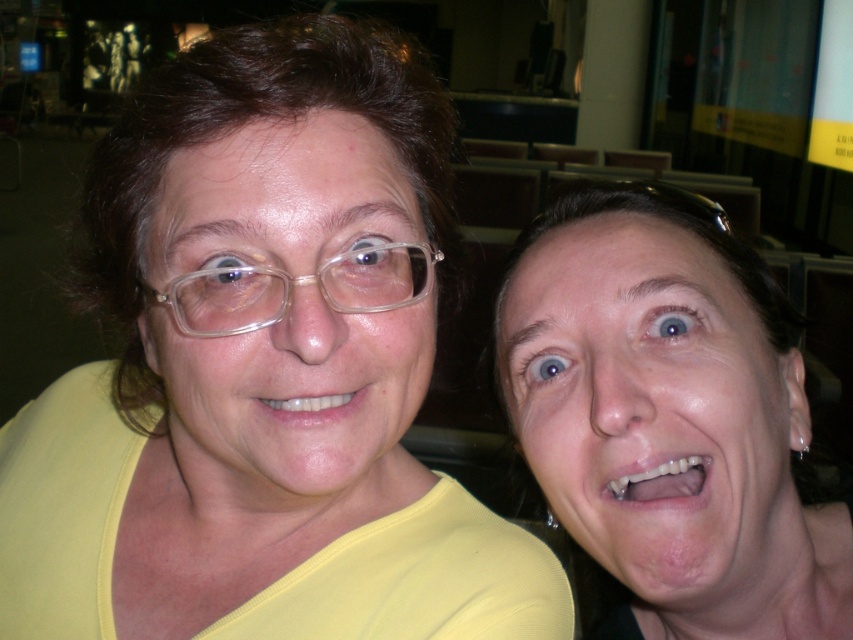
Based on the photo, is transparent plastic glasses at upper left positioned before white glossy teeth at lower center?

Yes, transparent plastic glasses at upper left is closer to the viewer.

Can you confirm if transparent plastic glasses at upper left is positioned to the left of white glossy teeth at lower center?

Correct, you'll find transparent plastic glasses at upper left to the left of white glossy teeth at lower center.

What do you see at coordinates (296, 285) in the screenshot?
I see `transparent plastic glasses at upper left` at bounding box center [296, 285].

In order to click on transparent plastic glasses at upper left in this screenshot , I will do `click(296, 285)`.

Is point (106, 442) closer to viewer compared to point (740, 481)?

No, it is not.

Is yellow matte shirt at upper left to the left of matte yellow shirt at right from the viewer's perspective?

Correct, you'll find yellow matte shirt at upper left to the left of matte yellow shirt at right.

Is point (387, 500) farther from camera compared to point (674, 486)?

Yes, point (387, 500) is farther from viewer.

At what (x,y) coordinates should I click in order to perform the action: click on yellow matte shirt at upper left. Please return your answer as a coordinate pair (x, y). The image size is (853, 640). Looking at the image, I should click on (260, 371).

Does point (170, 308) come farther from viewer compared to point (293, 397)?

Yes, it is behind point (293, 397).

Can you confirm if transparent plastic glasses at upper left is positioned below matte white teeth at center?

Incorrect, transparent plastic glasses at upper left is not positioned below matte white teeth at center.

Is point (381, 269) less distant than point (309, 413)?

That is False.

This screenshot has width=853, height=640. What are the coordinates of `transparent plastic glasses at upper left` in the screenshot? It's located at (296, 285).